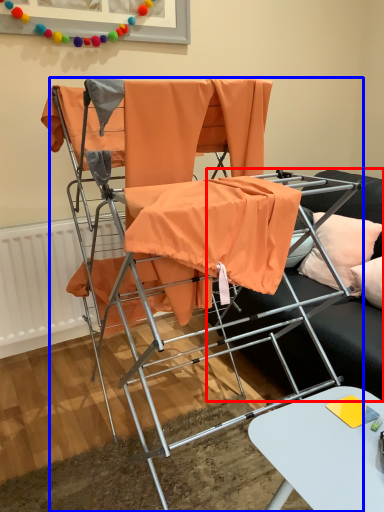
Question: Which object appears closest to the camera in this image, studio couch (highlighted by a red box) or chair (highlighted by a blue box)?

Choices:
 (A) studio couch
 (B) chair

Answer: (B)